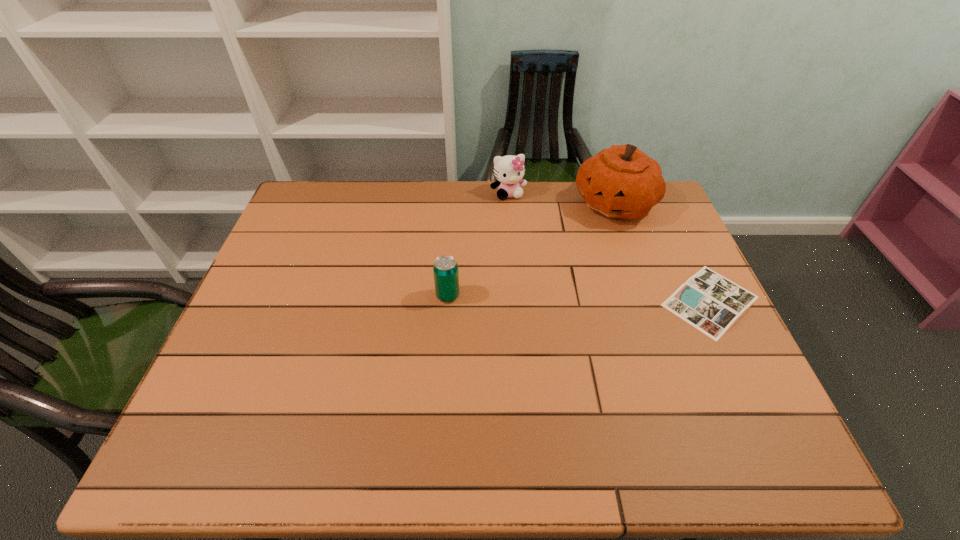
What are the coordinates of `blank space at the near edge of the desktop` in the screenshot? It's located at (620, 382).

At what (x,y) coordinates should I click in order to perform the action: click on vacant space at the left edge of the desktop. Please return your answer as a coordinate pair (x, y). Looking at the image, I should click on (273, 301).

The width and height of the screenshot is (960, 540). In the image, there is a desktop. Identify the location of vacant space at the right edge. (681, 261).

In the image, there is a desktop. In order to click on vacant space at the far left corner in this screenshot , I will do `click(300, 220)`.

Find the location of a particular element. The width and height of the screenshot is (960, 540). free space at the near right corner of the desktop is located at coordinates (735, 415).

Find the location of `free spot between the tallest object and the kitten`. free spot between the tallest object and the kitten is located at coordinates (562, 199).

Find the location of a particular element. The height and width of the screenshot is (540, 960). free space that is in between the third tallest object and the kitten is located at coordinates (478, 245).

Identify the location of free space between the second shortest object and the pumpkin. (531, 249).

Find the location of a particular element. This screenshot has height=540, width=960. unoccupied area between the pumpkin and the leftmost object is located at coordinates (531, 249).

Where is `vacant area that lies between the third shortest object and the shortest object`? The image size is (960, 540). vacant area that lies between the third shortest object and the shortest object is located at coordinates (610, 247).